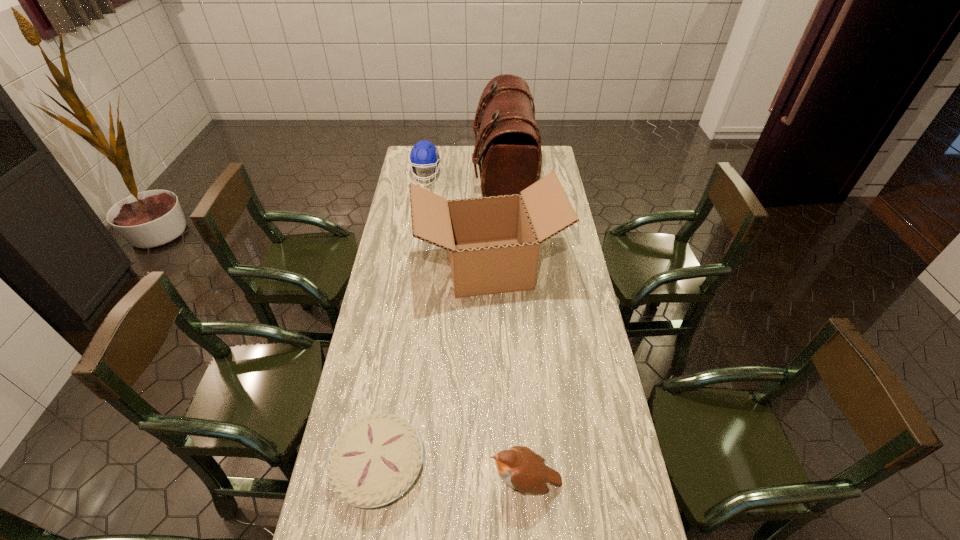
Image resolution: width=960 pixels, height=540 pixels. In order to click on the tallest object in this screenshot , I will do `click(507, 148)`.

Identify the location of box. (493, 242).

This screenshot has width=960, height=540. Identify the location of the fourth shortest object. (493, 242).

The width and height of the screenshot is (960, 540). Identify the location of football helmet. (423, 154).

Where is `bird`? bird is located at coordinates (521, 468).

Find the location of a particular element. The width and height of the screenshot is (960, 540). pie is located at coordinates (375, 460).

I want to click on free spot located on the front-facing side of the satchel, so click(444, 176).

Where is `vacant space located on the front-facing side of the satchel`? vacant space located on the front-facing side of the satchel is located at coordinates (410, 176).

This screenshot has height=540, width=960. Find the location of `free space located 0.070m on the front-facing side of the satchel`. free space located 0.070m on the front-facing side of the satchel is located at coordinates (459, 176).

Where is `free space located 0.070m on the right of the box`? Image resolution: width=960 pixels, height=540 pixels. free space located 0.070m on the right of the box is located at coordinates (581, 266).